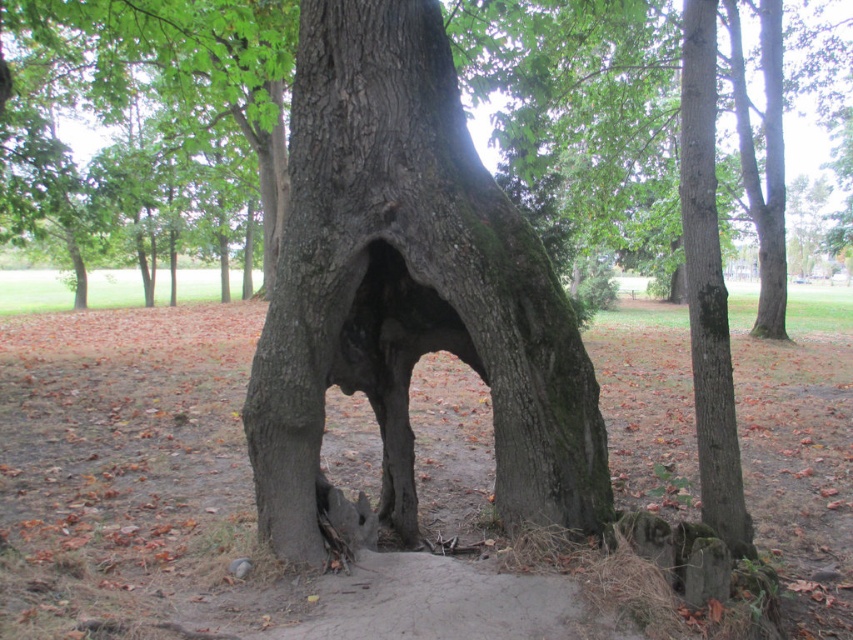
Question: Does smooth bark tree trunk at center have a lesser width compared to dark gray bark hole at center?

Choices:
 (A) yes
 (B) no

Answer: (B)

Question: Which point is closer to the camera taking this photo?

Choices:
 (A) (398, 504)
 (B) (386, 435)

Answer: (A)

Question: Which point is farther to the camera?

Choices:
 (A) smooth bark tree trunk at right
 (B) smooth bark tree trunk at center
 (C) dark gray bark hole at center

Answer: (C)

Question: Among these points, which one is nearest to the camera?

Choices:
 (A) (393, 156)
 (B) (700, 140)
 (C) (347, 356)

Answer: (B)

Question: Is smooth bark tree trunk at right to the left of dark gray bark hole at center from the viewer's perspective?

Choices:
 (A) yes
 (B) no

Answer: (B)

Question: Is smooth bark tree trunk at right to the left of dark gray bark hole at center from the viewer's perspective?

Choices:
 (A) yes
 (B) no

Answer: (B)